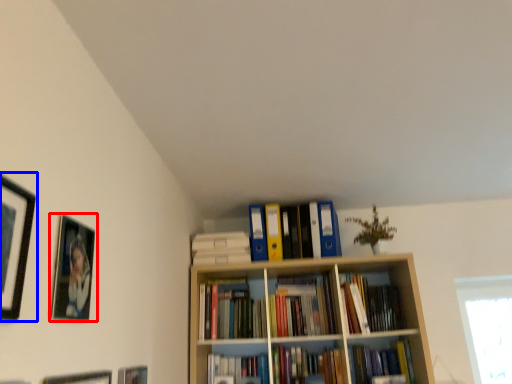
Question: Which point is further to the camera, picture frame (highlighted by a red box) or picture frame (highlighted by a blue box)?

Choices:
 (A) picture frame
 (B) picture frame

Answer: (A)